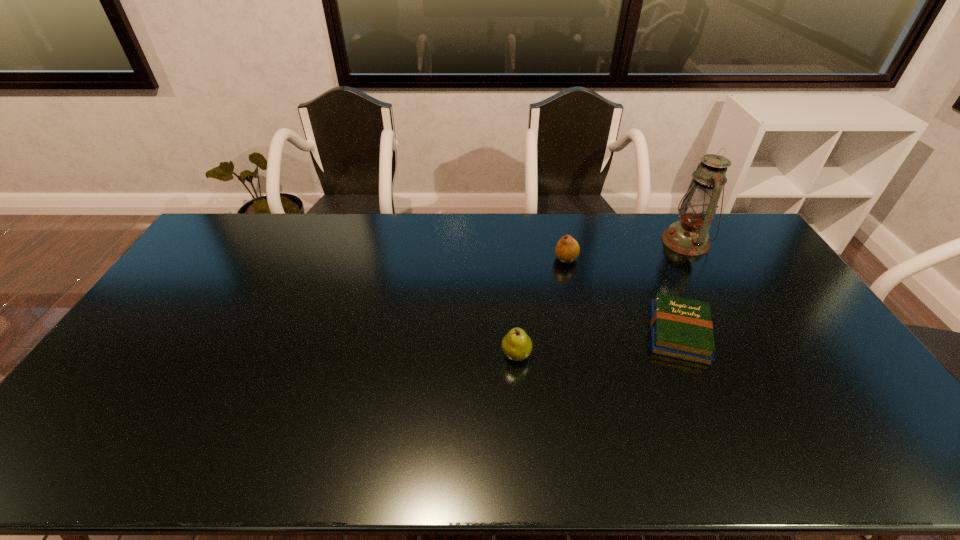
This screenshot has width=960, height=540. Find the location of `oil lamp located in the far edge section of the desktop`. oil lamp located in the far edge section of the desktop is located at coordinates (689, 236).

Where is `pear that is at the far edge`? The image size is (960, 540). pear that is at the far edge is located at coordinates (567, 249).

At what (x,y) coordinates should I click in order to perform the action: click on vacant space at the far edge. Please return your answer as a coordinate pair (x, y). Looking at the image, I should click on (275, 236).

This screenshot has height=540, width=960. In the image, there is a desktop. Find the location of `free space at the near edge`. free space at the near edge is located at coordinates (439, 471).

The width and height of the screenshot is (960, 540). I want to click on vacant space at the left edge, so click(x=196, y=284).

The image size is (960, 540). Find the location of `free space between the oil lamp and the leftmost object`. free space between the oil lamp and the leftmost object is located at coordinates (601, 298).

Identify the location of free point between the second object from left to right and the shortest object. The height and width of the screenshot is (540, 960). (622, 296).

Where is `vacant area between the right pear and the nearer pear`? The image size is (960, 540). vacant area between the right pear and the nearer pear is located at coordinates (541, 307).

This screenshot has width=960, height=540. Identify the location of vacant space that is in between the tallest object and the left pear. point(601,298).

Identify the location of unoccupied area between the shortest object and the oil lamp. (682, 287).